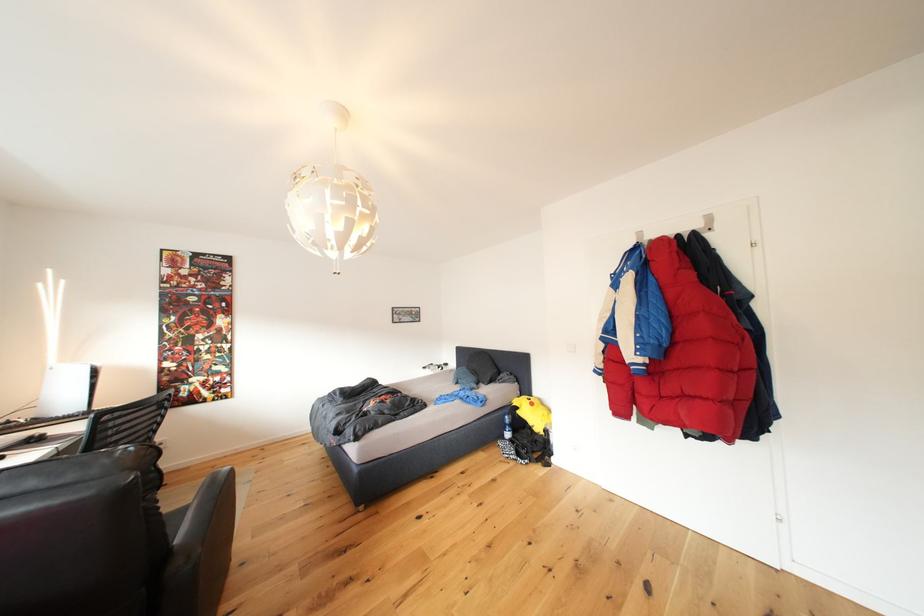
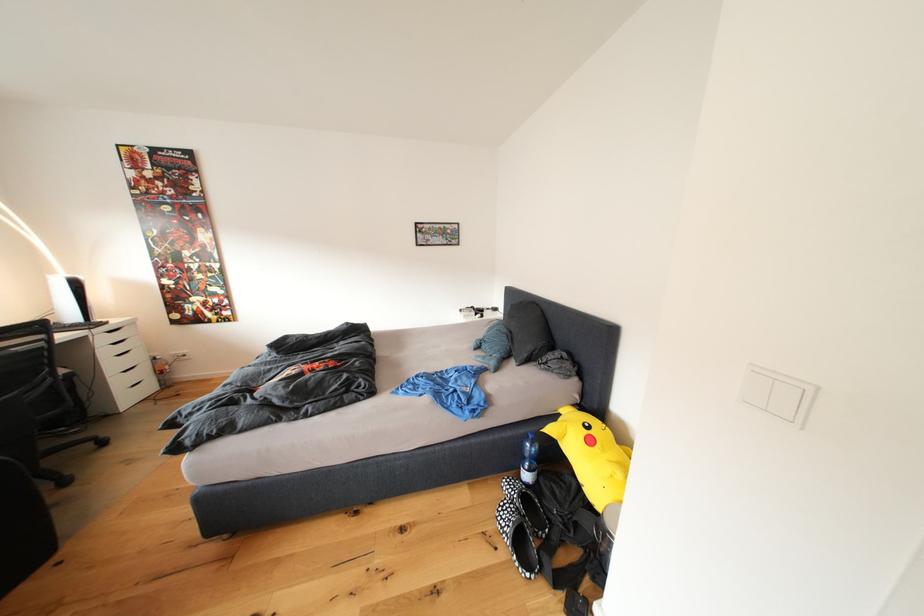
Locate, in the second image, the point that corresponds to (541,408) in the first image.

(600, 446)